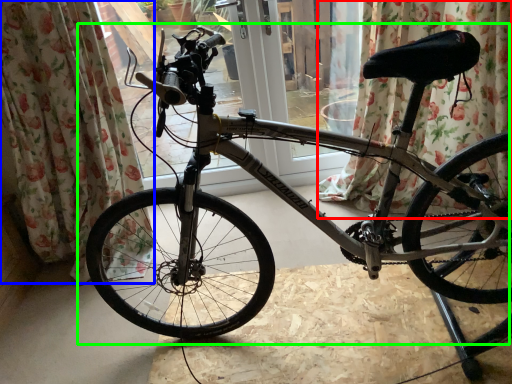
Question: Which is nearer to the curtain (highlighted by a red box)? curtain (highlighted by a blue box) or bicycle (highlighted by a green box).

Choices:
 (A) curtain
 (B) bicycle

Answer: (B)